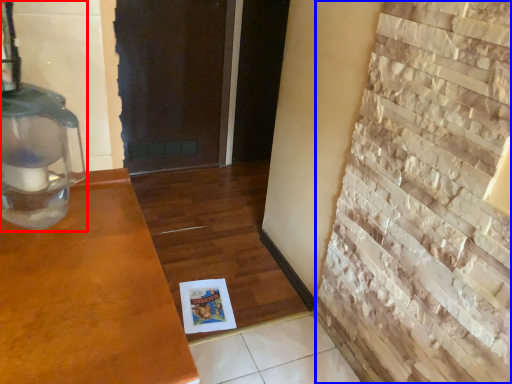
Question: Which object appears farthest to the camera in this image, oil lamp (highlighted by a red box) or brickwork (highlighted by a blue box)?

Choices:
 (A) oil lamp
 (B) brickwork

Answer: (A)